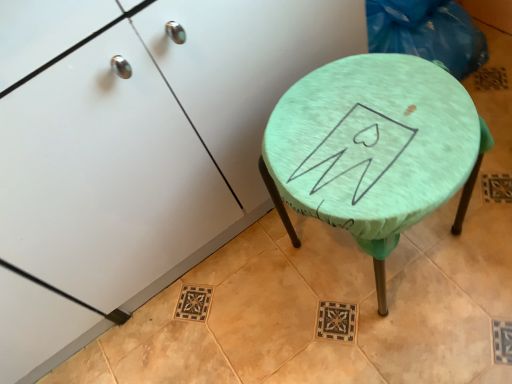
This screenshot has height=384, width=512. In order to click on blank area beneath teal fabric-covered stool at center (from a real-world perspective) in this screenshot , I will do `click(384, 261)`.